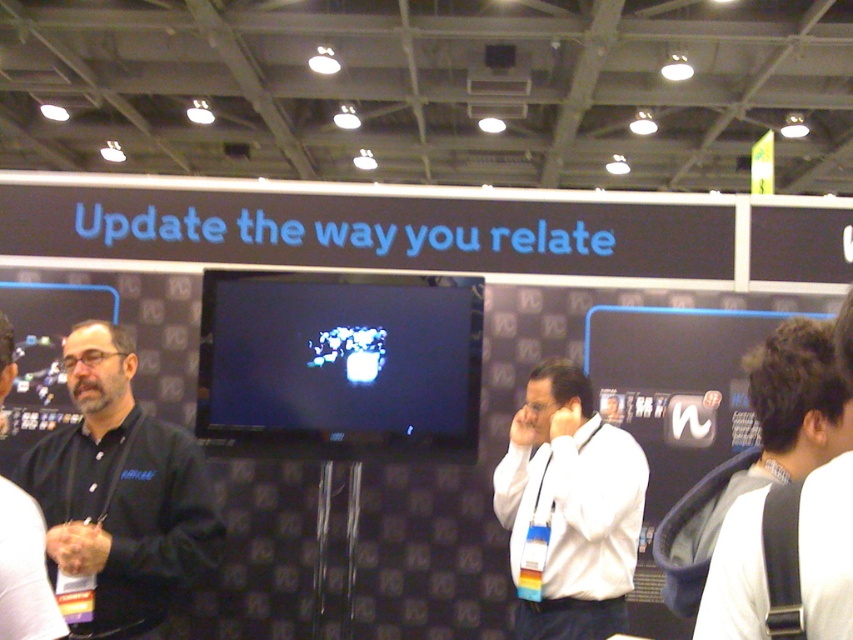
Question: Estimate the real-world distances between objects in this image. Which object is closer to the white shirt at right?

Choices:
 (A) black matte shirt at left
 (B) white matte shirt at center
 (C) dark blue shirt at left

Answer: (C)

Question: Is white matte shirt at center to the left of white shirt at right from the viewer's perspective?

Choices:
 (A) yes
 (B) no

Answer: (A)

Question: Based on their relative distances, which object is nearer to the black matte shirt at left?

Choices:
 (A) white matte shirt at center
 (B) dark blue shirt at left

Answer: (B)

Question: Is white matte shirt at center wider than dark blue shirt at left?

Choices:
 (A) no
 (B) yes

Answer: (B)

Question: From the image, what is the correct spatial relationship of black matte shirt at left in relation to white shirt at right?

Choices:
 (A) above
 (B) below

Answer: (B)

Question: Which point appears closest to the camera in this image?

Choices:
 (A) (25, 609)
 (B) (61, 499)

Answer: (A)